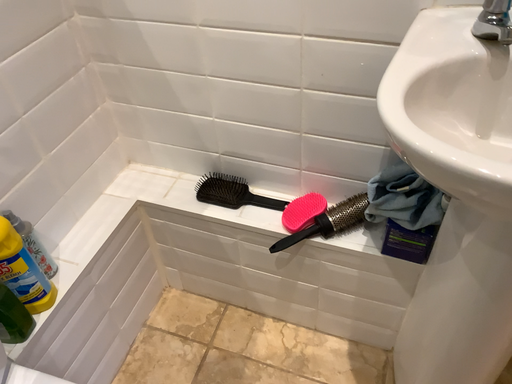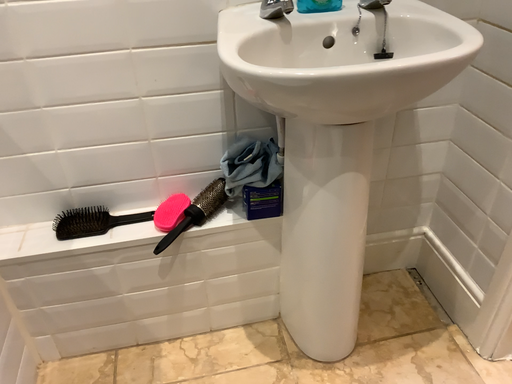
Question: How did the camera likely rotate when shooting the video?

Choices:
 (A) rotated right
 (B) rotated left

Answer: (A)